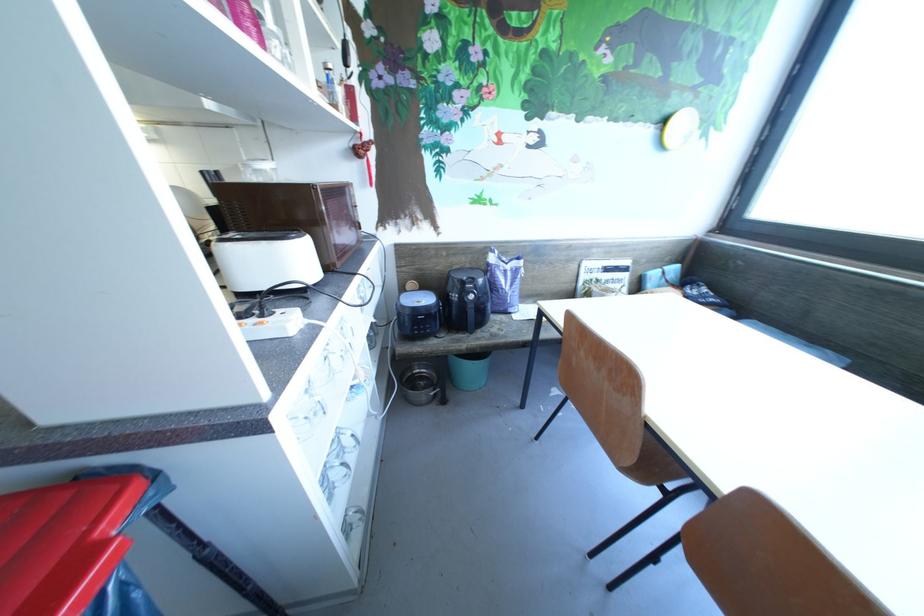
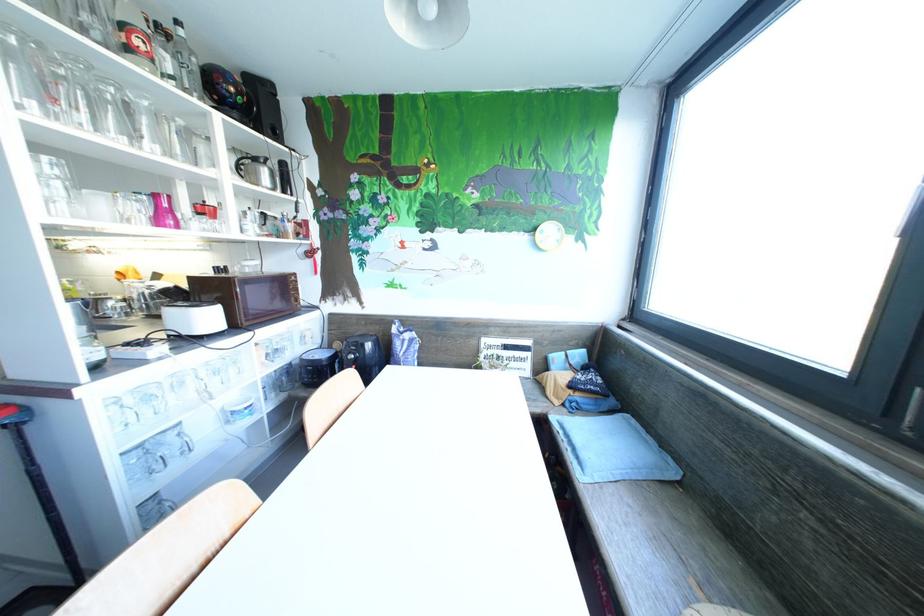
Question: I am providing you with two images of the same scene from different viewpoints. After the viewpoint changes to image2, which objects are now occluded?

Choices:
 (A) red bowl
 (B) blue bucket
 (C) pink plastic cup
 (D) glass bottle

Answer: (B)